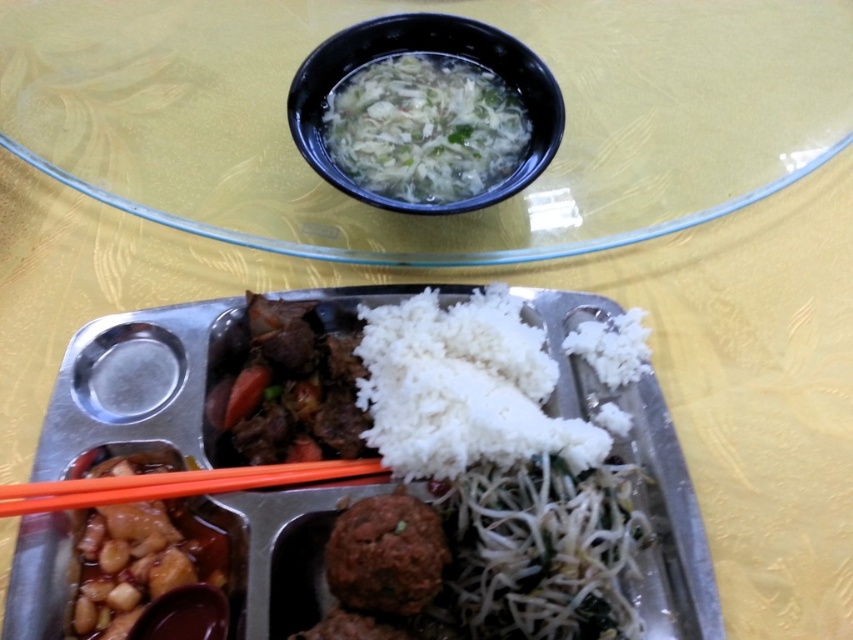
Question: Does white matte rice at center appear over brown matte meatball at center?

Choices:
 (A) no
 (B) yes

Answer: (B)

Question: Does transparent glass bowl at upper center have a lesser width compared to black plastic bowl at upper center?

Choices:
 (A) yes
 (B) no

Answer: (B)

Question: Considering the real-world distances, which object is closest to the black plastic bowl at upper center?

Choices:
 (A) orange plastic chopsticks at lower center
 (B) brown matte meatball at center
 (C) white matte tray at center

Answer: (C)

Question: Which object appears closest to the camera in this image?

Choices:
 (A) white matte tray at center
 (B) brown matte meatball at center

Answer: (B)

Question: Does transparent glass bowl at upper center have a smaller size compared to white matte tray at center?

Choices:
 (A) no
 (B) yes

Answer: (A)

Question: Which is nearer to the white matte tray at center?

Choices:
 (A) brown matte meatball at center
 (B) orange plastic chopsticks at lower center
 (C) white matte rice at center
 (D) transparent glass bowl at upper center

Answer: (C)